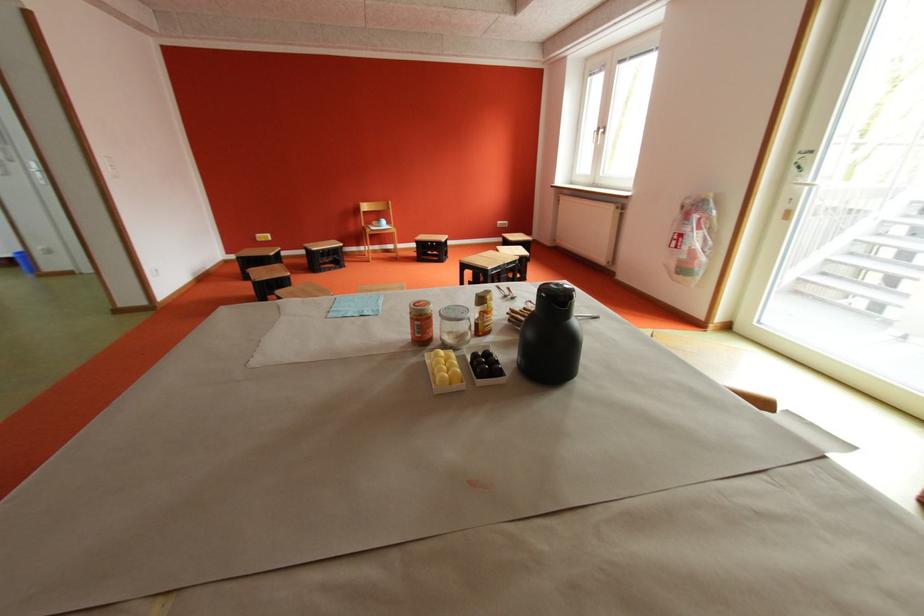
Find where to turn the window handle. Please return your answer as a coordinate pair (x, y).

(599, 134)